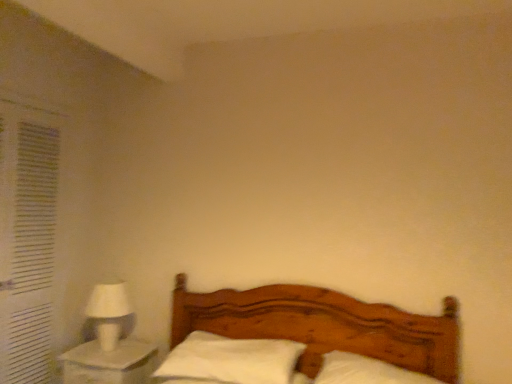
Question: Considering the positions of white soft pillow at center, placed as the first pillow when sorted from right to left, and white soft pillow at center, the first pillow from the left, in the image, is white soft pillow at center, placed as the first pillow when sorted from right to left, bigger or smaller than white soft pillow at center, the first pillow from the left,?

Choices:
 (A) small
 (B) big

Answer: (B)

Question: From the image's perspective, is white soft pillow at center, acting as the 2th pillow starting from the left, above or below white soft pillow at center, the first pillow from the left?

Choices:
 (A) below
 (B) above

Answer: (A)

Question: Based on their relative distances, which object is farther from the wooden bed at center?

Choices:
 (A) white matte table lamp at left
 (B) white fabric curtain at left
 (C) white soft pillow at center, placed as the first pillow when sorted from right to left
 (D) white soft pillow at center, the first pillow from the left
 (E) white glossy nightstand at lower left

Answer: (B)

Question: Which object is positioned closest to the white fabric curtain at left?

Choices:
 (A) white glossy nightstand at lower left
 (B) wooden bed at center
 (C) white matte table lamp at left
 (D) white soft pillow at center, which ranks as the 2th pillow in right-to-left order
 (E) white soft pillow at center, acting as the 2th pillow starting from the left

Answer: (C)